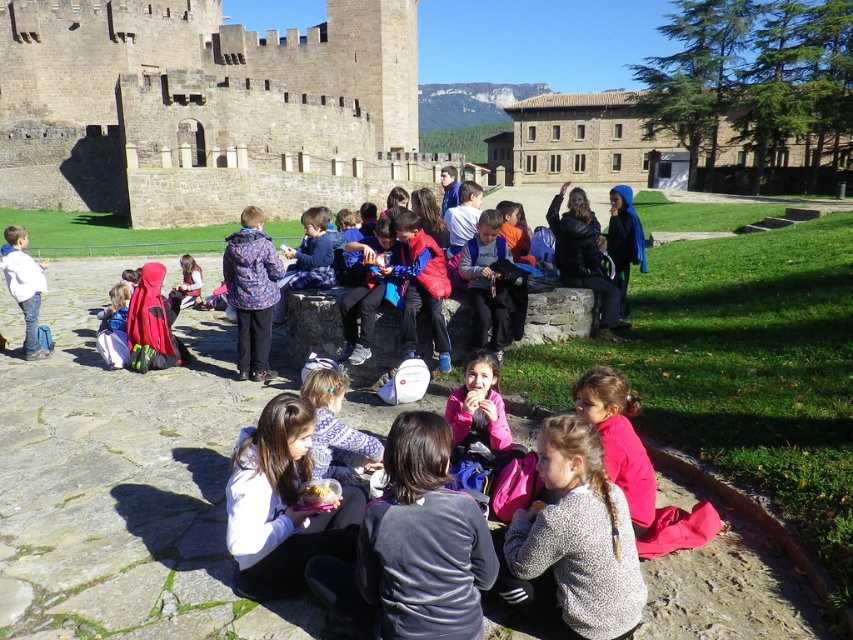
Question: Based on their relative distances, which object is farther from the speckled gray sweater at lower right?

Choices:
 (A) brown stone fort at upper left
 (B) white matte jacket at lower left
 (C) matte pink hoodie at center
 (D) white fleece jacket at lower center

Answer: (A)

Question: Considering the relative positions of speckled gray sweater at lower right and matte pink hoodie at center in the image provided, where is speckled gray sweater at lower right located with respect to matte pink hoodie at center?

Choices:
 (A) left
 (B) right

Answer: (B)

Question: Estimate the real-world distances between objects in this image. Which object is farther from the brown stone building at center?

Choices:
 (A) yellow matte food at center
 (B) speckled gray sweater at lower right

Answer: (A)

Question: Does speckled gray sweater at lower right appear over white fleece jacket at lower center?

Choices:
 (A) yes
 (B) no

Answer: (B)

Question: Which object appears farthest from the camera in this image?

Choices:
 (A) speckled gray sweater at lower right
 (B) brown stone fort at upper left

Answer: (B)

Question: Does brown stone fort at upper left appear under white fleece jacket at lower center?

Choices:
 (A) yes
 (B) no

Answer: (B)